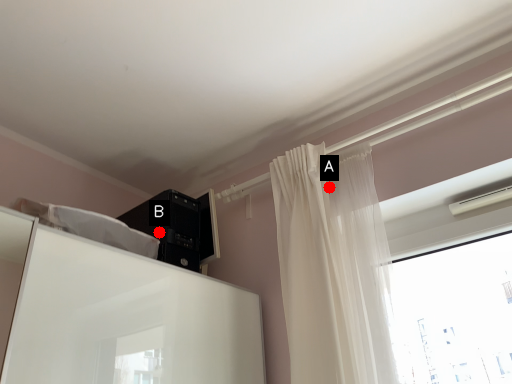
Question: Two points are circled on the image, labeled by A and B beside each circle. Which point is closer to the camera?

Choices:
 (A) A is closer
 (B) B is closer

Answer: (A)